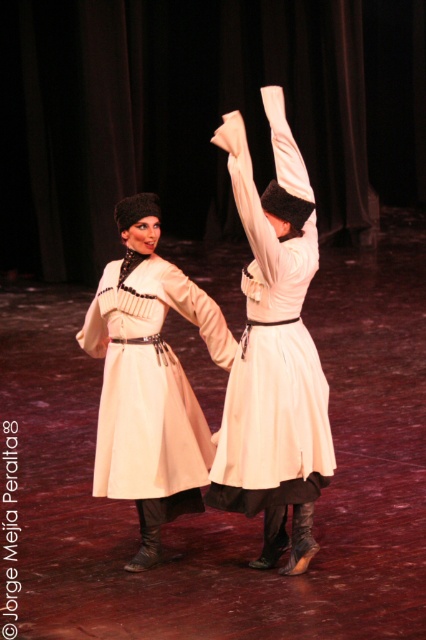
You are a stagehand preparing to adjust the lighting for the performance. You need to position a spotlight directly above the matte white coat at center. According to the stage coordinates provided, where should you aim the spotlight?

The matte white coat at center is located at point (149, 380), so you should aim the spotlight directly above those coordinates to properly illuminate the coat.

You are a photographer positioned at the front of the stage. You want to capture a closeup shot of the white satin dress at center. Based on its position, where should you aim your camera?

The white satin dress at center is located at coordinates point (x=273, y=339). To capture a closeup, aim your camera towards the center of the stage slightly to the right and lower portion.